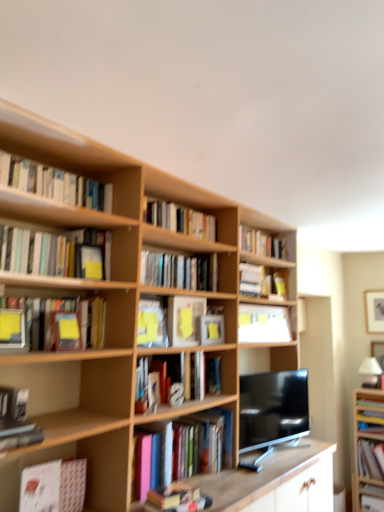
Question: Is yellow matte paper at center, marked as the third paperback book in a left-to-right arrangement, wider or thinner than hardcover books at center, which appears as the ninth book when ordered from the bottom?

Choices:
 (A) wide
 (B) thin

Answer: (B)

Question: Is point (193, 331) positioned closer to the camera than point (215, 287)?

Choices:
 (A) farther
 (B) closer

Answer: (B)

Question: Based on their relative distances, which object is nearer to the hardcover books at upper left, which is the thirteenth book in bottom-to-top order?

Choices:
 (A) matte white book at lower right, the 13th book when ordered from top to bottom
 (B) metallic gray hardcover book at lower left, the ninth book positioned from the top
 (C) hardcover book at center, which is the 11th book in top-to-bottom order
 (D) matte black tv at center
 (E) yellow matte paper at center, the second paperback book from the back

Answer: (E)

Question: Estimate the real-world distances between objects in this image. Which object is closer to the hardcover books at center, which appears as the 12th book when ordered from the bottom?

Choices:
 (A) wooden bookcase at right, which is counted as the 2th bookcase, starting from the top
 (B) hardcover book at center, which ranks as the 6th book in top-to-bottom order
 (C) matte yellow book at left, the 7th book from the top
 (D) white matte bookshelf at upper center, marked as the 6th book in a bottom-to-top arrangement
 (E) yellow matte paper at center, the second paperback book from the back

Answer: (E)